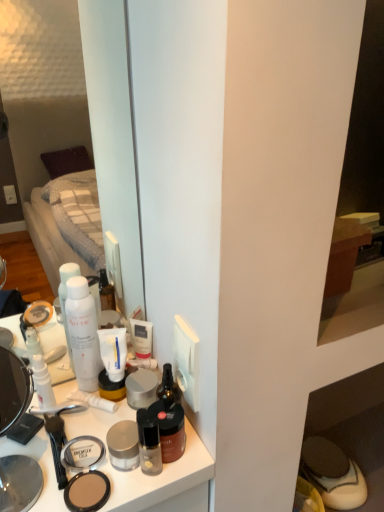
Question: Relative to translucent glass bottle at center, which is the 2th toiletry from right to left, is matte brown shoe at lower right in front or behind?

Choices:
 (A) front
 (B) behind

Answer: (B)

Question: Would you say matte brown shoe at lower right is to the left or to the right of translucent glass bottle at center, which ranks as the third toiletry in left-to-right order, in the picture?

Choices:
 (A) left
 (B) right

Answer: (B)

Question: Considering the real-world distances, which object is closest to the matte brown shoe at lower right?

Choices:
 (A) white matte tube at center
 (B) translucent glass bottle at center, which is the 2th toiletry from right to left
 (C) matte plastic makeup at center
 (D) satin silver face powder at center, which is the first face powder in back-to-front order
 (E) brown matte jar at center, which appears as the 1th toiletry when viewed from the right

Answer: (C)

Question: Which of these objects is positioned closest to the white matte pump bottle at upper left, which is the fourth toiletry from right to left?

Choices:
 (A) matte brown shoe at lower right
 (B) transparent plastic mirror at upper left
 (C) brown matte jar at center, which appears as the 1th toiletry when viewed from the right
 (D) satin silver face powder at center, the third face powder viewed from the front
 (E) matte silver jar at center, arranged as the 2th face powder when viewed from the back

Answer: (D)